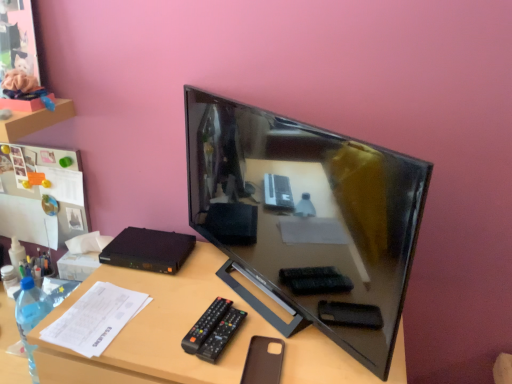
Where is `blank space situated above brown matte desk at center (from a real-world perspective)`? blank space situated above brown matte desk at center (from a real-world perspective) is located at coordinates (217, 297).